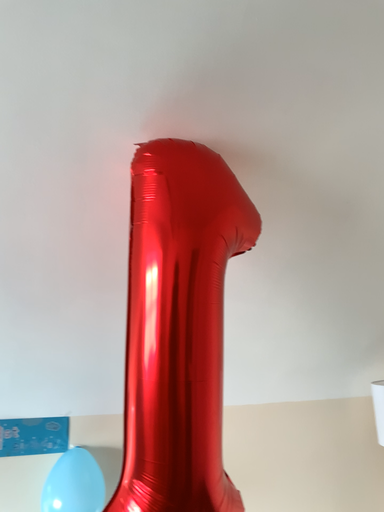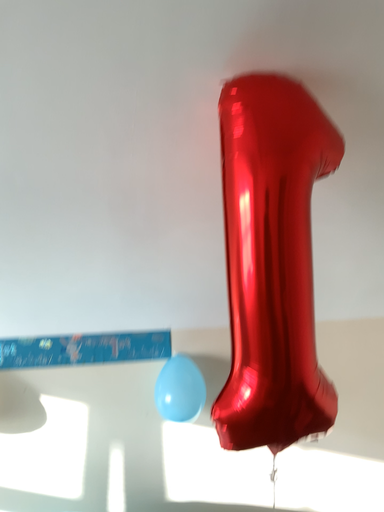
Question: Which way did the camera rotate in the video?

Choices:
 (A) rotated downward
 (B) rotated upward

Answer: (A)